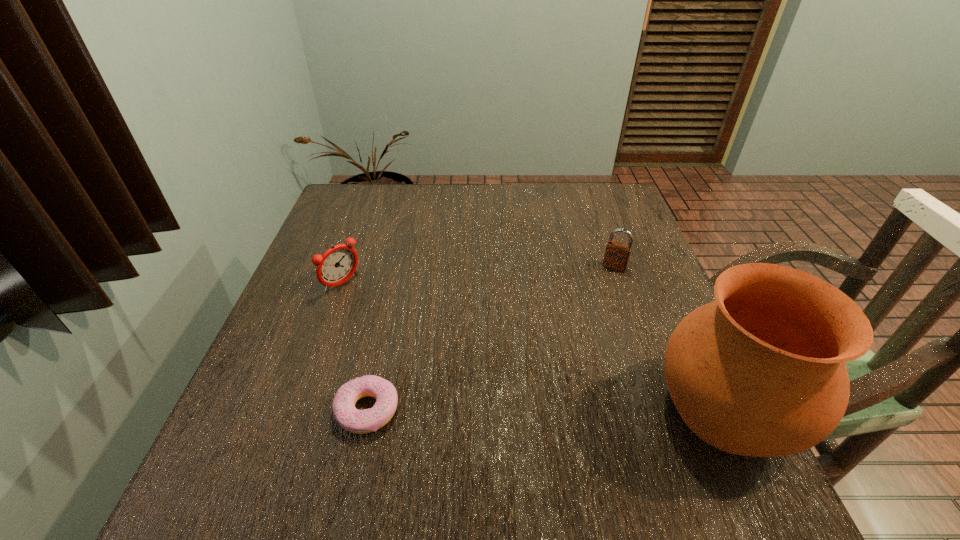
You are a GUI agent. You are given a task and a screenshot of the screen. Output one action in this format:
    pyautogui.click(x=<x>, y=<y>)
    Task: Click on the vacant point located between the shortest object and the padlock
    
    Given the screenshot: What is the action you would take?
    pyautogui.click(x=491, y=339)

Where is `vacant space in between the padlock and the leftmost object`? vacant space in between the padlock and the leftmost object is located at coordinates (479, 275).

At what (x,y) coordinates should I click in order to perform the action: click on vacant area that lies between the leftmost object and the shortest object. Please return your answer as a coordinate pair (x, y). The height and width of the screenshot is (540, 960). Looking at the image, I should click on (355, 347).

Where is `free space between the tallest object and the alarm clock`? free space between the tallest object and the alarm clock is located at coordinates point(535,347).

You are a GUI agent. You are given a task and a screenshot of the screen. Output one action in this format:
    pyautogui.click(x=<x>, y=<y>)
    Task: Click on the free space between the tallest object and the leftmost object
    The width and height of the screenshot is (960, 540).
    Given the screenshot: What is the action you would take?
    pyautogui.click(x=535, y=347)

Where is `vacant area between the padlock and the third object from right to left`? Image resolution: width=960 pixels, height=540 pixels. vacant area between the padlock and the third object from right to left is located at coordinates pos(491,339).

In order to click on object that ranks as the third closest to the doughnut in this screenshot , I will do `click(617, 255)`.

Where is `object that is the second closest to the alarm clock`? object that is the second closest to the alarm clock is located at coordinates (617, 255).

The image size is (960, 540). I want to click on free space in the image that satisfies the following two spatial constraints: 1. on the front side of the alarm clock; 2. on the left side of the tallest object, so click(x=299, y=410).

Identify the location of free location that satisfies the following two spatial constraints: 1. on the back side of the padlock; 2. on the right side of the third object from right to left. (398, 267).